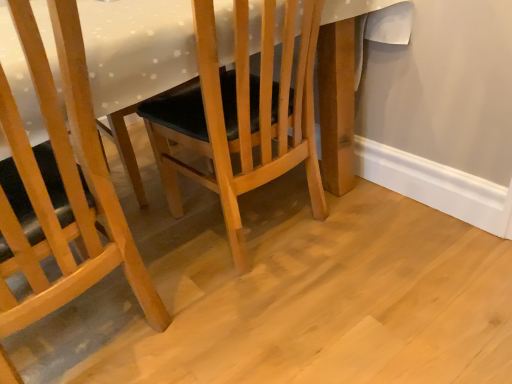
Locate an element on the screen. free spot to the right of matte wood chair at center, marked as the first chair in a left-to-right arrangement is located at coordinates (265, 321).